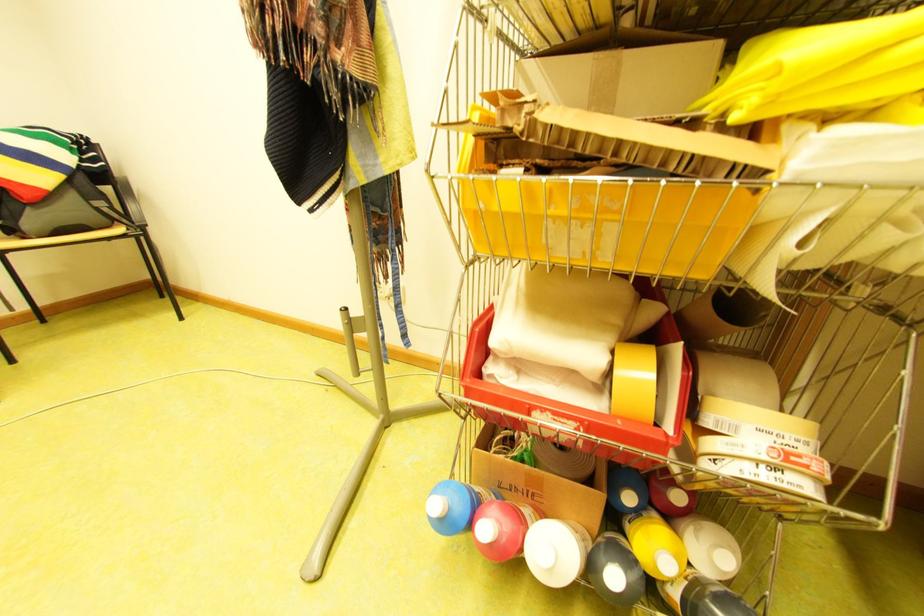
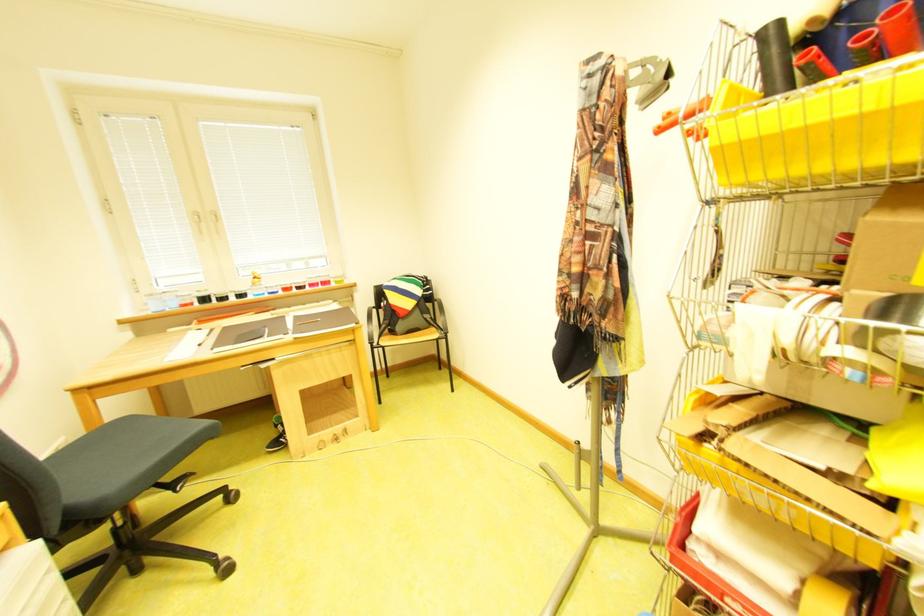
Question: The camera is either moving clockwise (left) or counter-clockwise (right) around the object. The first image is from the beginning of the video and the second image is from the end. Is the camera moving left or right when shooting the video?

Choices:
 (A) Left
 (B) Right

Answer: (B)